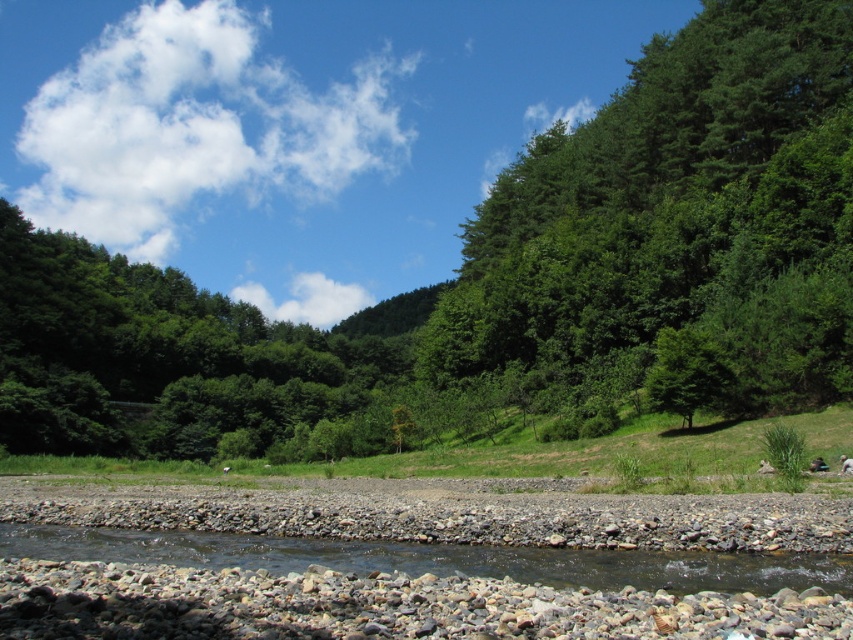
Question: Is gray gravel riverbed at lower center positioned behind smooth gravel river at lower center?

Choices:
 (A) no
 (B) yes

Answer: (A)

Question: Estimate the real-world distances between objects in this image. Which object is closer to the gray gravel riverbed at lower center?

Choices:
 (A) green leafy tree at upper right
 (B) green leafy forest at center

Answer: (A)

Question: Among these points, which one is farthest from the camera?

Choices:
 (A) (437, 339)
 (B) (664, 566)
 (C) (126, 636)
 (D) (207, 380)

Answer: (D)

Question: Which object is farther from the camera taking this photo?

Choices:
 (A) green leafy tree at upper right
 (B) smooth gravel river at lower center
 (C) green leafy forest at center
 (D) gray gravel riverbed at lower center

Answer: (C)

Question: From the image, what is the correct spatial relationship of green leafy tree at upper right in relation to smooth gravel river at lower center?

Choices:
 (A) right
 (B) left

Answer: (A)

Question: Can you confirm if green leafy tree at upper right is positioned to the left of smooth gravel river at lower center?

Choices:
 (A) no
 (B) yes

Answer: (A)